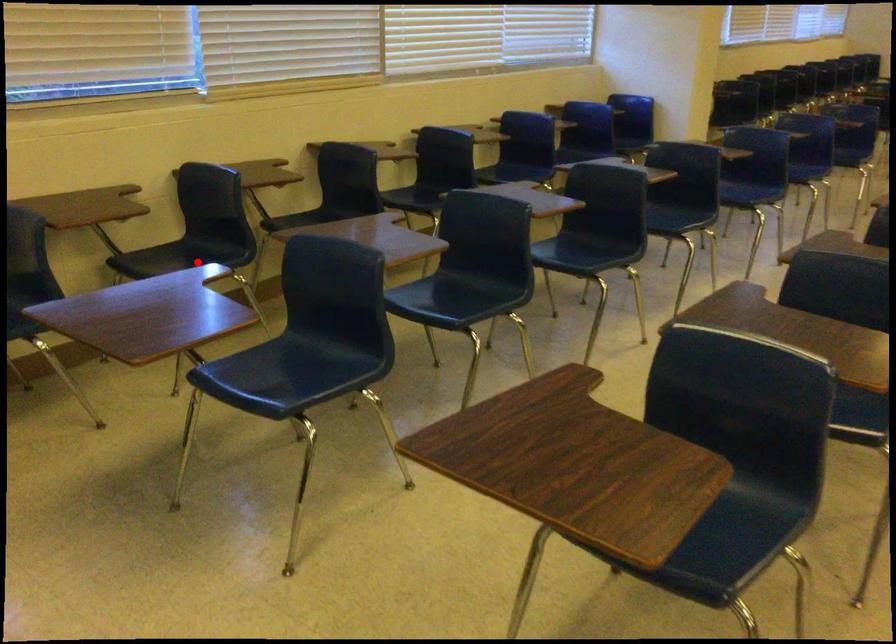
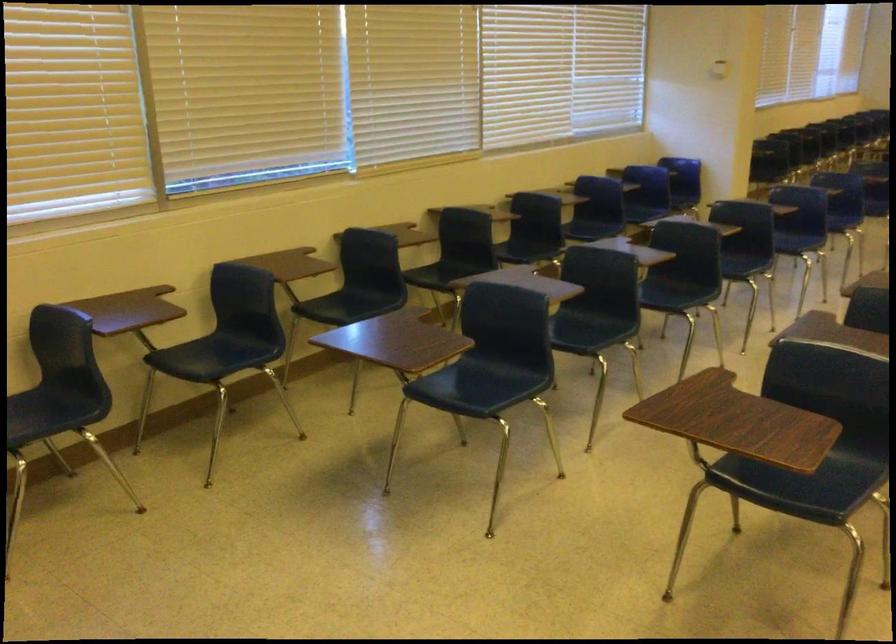
Question: I am providing you with two images of the same scene from different viewpoints. A red point is shown in image1. For the corresponding object point in image2, is it positioned nearer or farther from the camera?

Choices:
 (A) Nearer
 (B) Farther

Answer: (B)